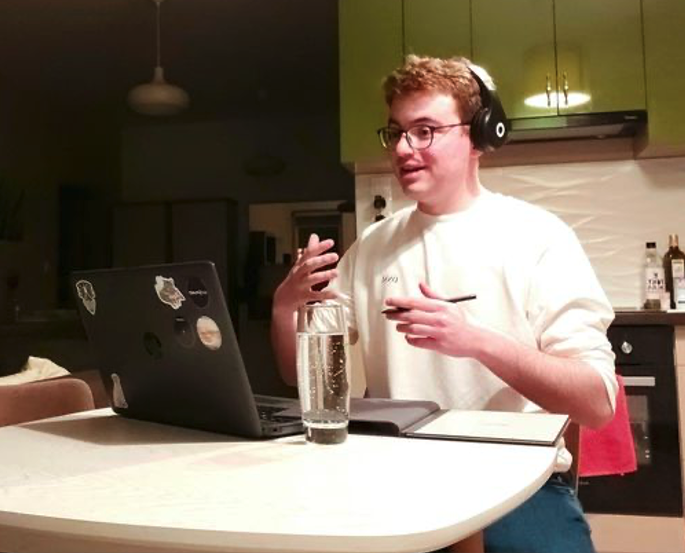
Find the location of a particular element. door handle is located at coordinates (564, 87).